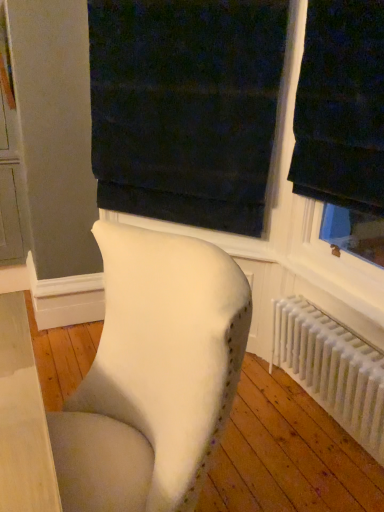
Question: From the image's perspective, is white plastic radiator at lower right above or below dark velvet curtain at upper center?

Choices:
 (A) below
 (B) above

Answer: (A)

Question: Considering the positions of white plastic radiator at lower right and dark velvet curtain at upper center in the image, is white plastic radiator at lower right taller or shorter than dark velvet curtain at upper center?

Choices:
 (A) short
 (B) tall

Answer: (A)

Question: Estimate the real-world distances between objects in this image. Which object is farther from the white plastic radiator at lower right?

Choices:
 (A) white fabric chair at center
 (B) dark velvet curtain at upper center

Answer: (A)

Question: Which of these objects is positioned farthest from the white plastic radiator at lower right?

Choices:
 (A) dark velvet curtain at upper center
 (B) white fabric chair at center

Answer: (B)